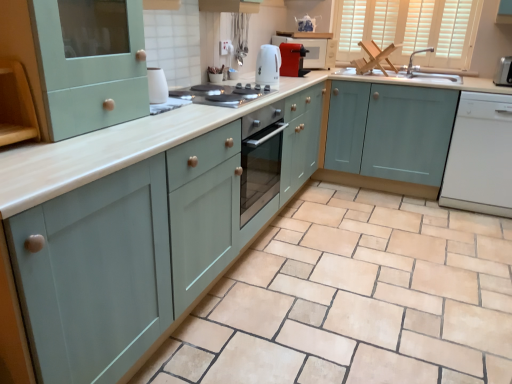
Question: Considering the relative positions of matte silver faucet at upper right and white glossy electric stove at center in the image provided, is matte silver faucet at upper right in front of white glossy electric stove at center?

Choices:
 (A) yes
 (B) no

Answer: (B)

Question: Considering the relative positions of matte silver faucet at upper right and white glossy electric stove at center in the image provided, is matte silver faucet at upper right to the right of white glossy electric stove at center from the viewer's perspective?

Choices:
 (A) yes
 (B) no

Answer: (A)

Question: From a real-world perspective, is matte silver faucet at upper right physically below white glossy electric stove at center?

Choices:
 (A) yes
 (B) no

Answer: (B)

Question: From the image's perspective, does matte silver faucet at upper right appear higher than white glossy electric stove at center?

Choices:
 (A) yes
 (B) no

Answer: (A)

Question: From a real-world perspective, is matte silver faucet at upper right located higher than white glossy electric stove at center?

Choices:
 (A) no
 (B) yes

Answer: (B)

Question: Based on their sizes in the image, would you say white glossy electric stove at center is bigger or smaller than matte ceramic tile at center?

Choices:
 (A) small
 (B) big

Answer: (A)

Question: Is white glossy electric stove at center situated inside matte ceramic tile at center or outside?

Choices:
 (A) outside
 (B) inside

Answer: (A)

Question: Is point (188, 99) closer or farther from the camera than point (141, 375)?

Choices:
 (A) closer
 (B) farther

Answer: (B)

Question: From a real-world perspective, is white glossy electric stove at center above or below matte ceramic tile at center?

Choices:
 (A) above
 (B) below

Answer: (A)

Question: Based on their sizes in the image, would you say matte red microwave at upper center is bigger or smaller than light blue wood cabinet at center, the fourth cabinetry from the left?

Choices:
 (A) small
 (B) big

Answer: (A)

Question: Visually, is matte red microwave at upper center positioned to the left or to the right of light blue wood cabinet at center, which is counted as the first cabinetry, starting from the right?

Choices:
 (A) right
 (B) left

Answer: (B)

Question: Is matte red microwave at upper center inside or outside of light blue wood cabinet at center, which is counted as the first cabinetry, starting from the right?

Choices:
 (A) outside
 (B) inside

Answer: (A)

Question: From the image's perspective, is matte red microwave at upper center positioned above or below light blue wood cabinet at center, which is counted as the first cabinetry, starting from the right?

Choices:
 (A) below
 (B) above

Answer: (B)

Question: From the image's perspective, relative to white glossy dishwasher at right, is white glossy electric kettle at center, placed as the third appliance when sorted from right to left, above or below?

Choices:
 (A) below
 (B) above

Answer: (B)

Question: From a real-world perspective, relative to white glossy dishwasher at right, is white glossy electric kettle at center, which is counted as the 2th appliance, starting from the left, vertically above or below?

Choices:
 (A) below
 (B) above

Answer: (B)